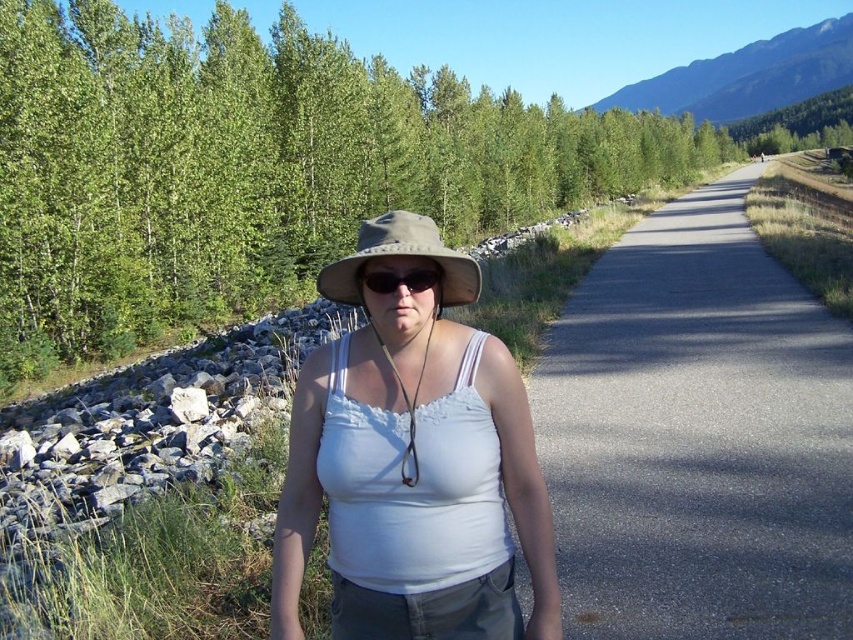
Does green leafy trees at center appear on the left side of blue rocky mountain at upper right?

Indeed, green leafy trees at center is positioned on the left side of blue rocky mountain at upper right.

Based on the photo, who is more forward, (729, 152) or (741, 102)?

Point (729, 152) is in front.

Is point (201, 273) positioned in front of point (682, 83)?

That is True.

Identify the location of green leafy trees at center. The image size is (853, 640). (253, 168).

Does matte white tank top at center have a lesser width compared to black matte sunglasses at center?

No.

At what (x,y) coordinates should I click in order to perform the action: click on matte white tank top at center. Please return your answer as a coordinate pair (x, y). Image resolution: width=853 pixels, height=640 pixels. Looking at the image, I should click on (412, 442).

You are a GUI agent. You are given a task and a screenshot of the screen. Output one action in this format:
    pyautogui.click(x=<x>, y=<y>)
    Task: Click on the matte white tank top at center
    The height and width of the screenshot is (640, 853).
    Given the screenshot: What is the action you would take?
    pyautogui.click(x=412, y=442)

Which is below, tan fabric hat at center or black matte sunglasses at center?

black matte sunglasses at center is below.

This screenshot has height=640, width=853. What do you see at coordinates (401, 253) in the screenshot?
I see `tan fabric hat at center` at bounding box center [401, 253].

Is point (329, 278) in front of point (437, 282)?

No.

Where is `tan fabric hat at center`? Image resolution: width=853 pixels, height=640 pixels. tan fabric hat at center is located at coordinates (401, 253).